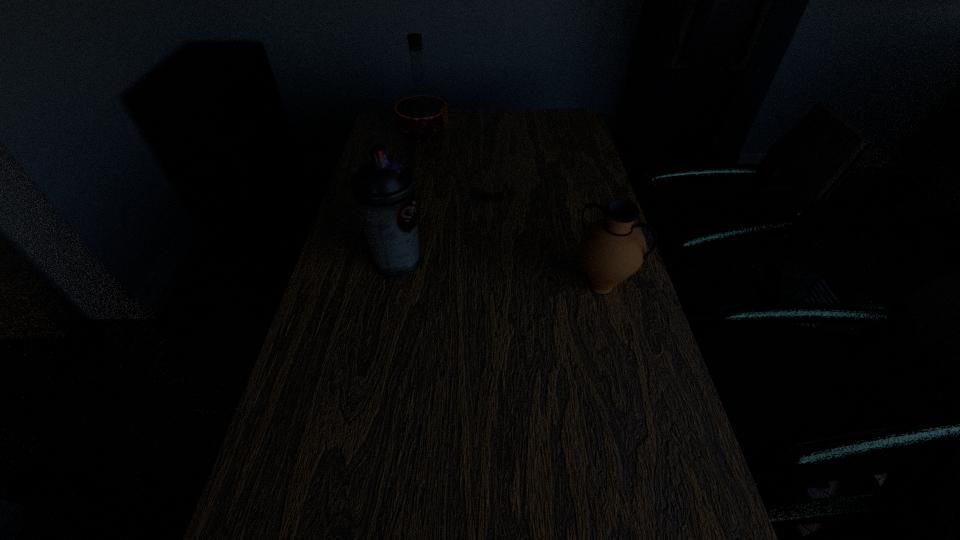
I want to click on object located at the far edge, so coord(421,113).

The height and width of the screenshot is (540, 960). What are the coordinates of `liquor that is at the left edge` in the screenshot? It's located at (421, 113).

Where is `aerosol can present at the left edge`? aerosol can present at the left edge is located at coordinates (384, 189).

Find the location of a particular element. Image resolution: width=960 pixels, height=540 pixels. object that is positioned at the right edge is located at coordinates tap(612, 248).

The height and width of the screenshot is (540, 960). I want to click on object that is at the far left corner, so click(x=421, y=113).

Image resolution: width=960 pixels, height=540 pixels. Find the location of `free space at the far edge`. free space at the far edge is located at coordinates (506, 133).

Find the location of `vacant point at the left edge`. vacant point at the left edge is located at coordinates (347, 328).

Image resolution: width=960 pixels, height=540 pixels. In the image, there is a desktop. What are the coordinates of `vacant region at the right edge` in the screenshot? It's located at (668, 518).

Locate an element on the screen. The height and width of the screenshot is (540, 960). vacant space at the far right corner of the desktop is located at coordinates (562, 109).

I want to click on empty space between the third nearest object and the pitcher, so click(547, 244).